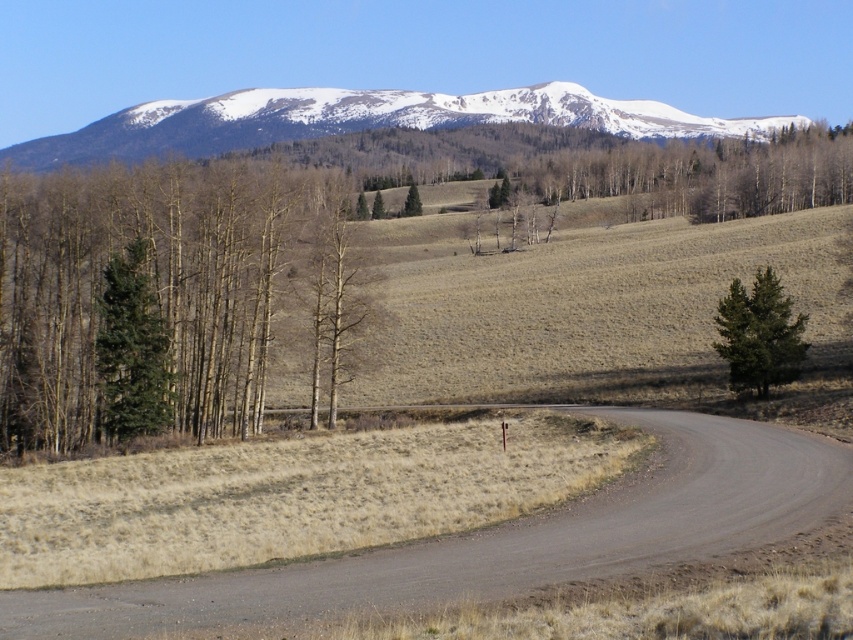
Question: Among these objects, which one is farthest from the camera?

Choices:
 (A) green matte tree at left
 (B) green textured tree at right
 (C) snowy mountain at upper center
 (D) green matte tree at center

Answer: (C)

Question: Among these points, which one is nearest to the camera?

Choices:
 (A) coord(137,353)
 (B) coord(415,189)

Answer: (A)

Question: Can you confirm if snowy mountain at upper center is wider than green matte evergreen tree at left?

Choices:
 (A) no
 (B) yes

Answer: (B)

Question: Is brown dirt track at lower center below green matte tree at center?

Choices:
 (A) no
 (B) yes

Answer: (B)

Question: Among these objects, which one is nearest to the camera?

Choices:
 (A) green matte tree at center
 (B) green textured tree at right
 (C) snowy mountain at upper center

Answer: (B)

Question: Does snowy mountain at upper center appear on the right side of green matte tree at center?

Choices:
 (A) no
 (B) yes

Answer: (A)